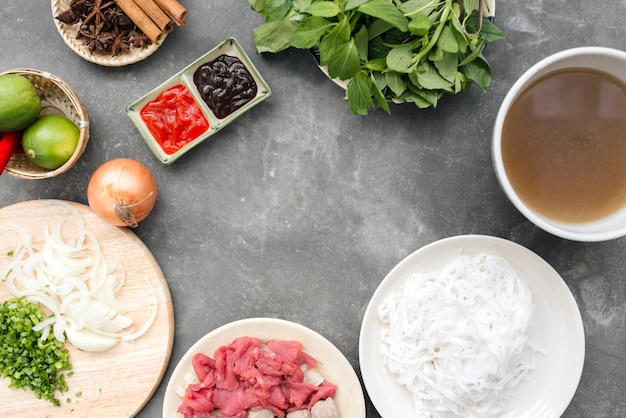
I want to click on gray table, so click(305, 220).